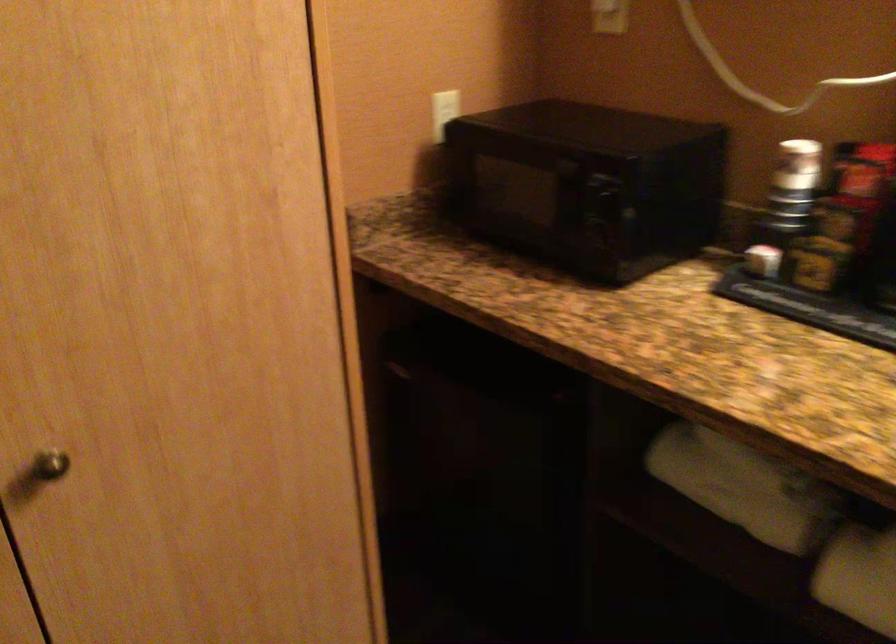
Find where to lift the small bottle. Please return your answer as a coordinate pair (x, y).

(762, 260)